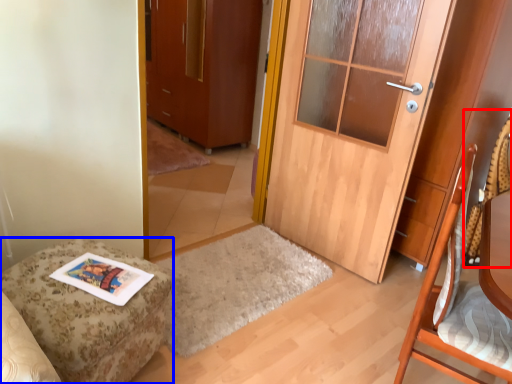
Question: Which object is closer to the camera taking this photo, swivel chair (highlighted by a red box) or furniture (highlighted by a blue box)?

Choices:
 (A) swivel chair
 (B) furniture

Answer: (B)